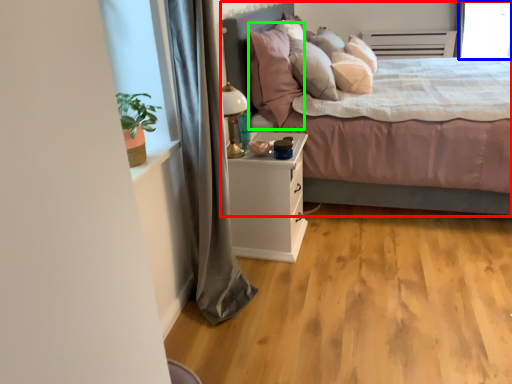
Question: Based on their relative distances, which object is nearer to bed (highlighted by a red box)? Choose from window screen (highlighted by a blue box) and pillow (highlighted by a green box).

Choices:
 (A) window screen
 (B) pillow

Answer: (B)